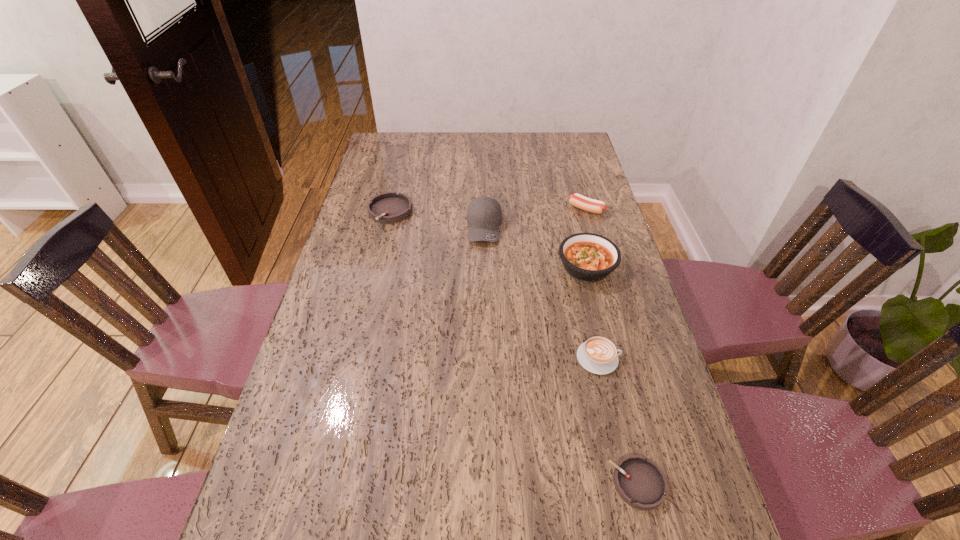
What are the coordinates of `the farther ashtray` in the screenshot? It's located at (389, 207).

You are a GUI agent. You are given a task and a screenshot of the screen. Output one action in this format:
    pyautogui.click(x=<x>, y=<y>)
    Task: Click on the leftmost object
    
    Given the screenshot: What is the action you would take?
    pyautogui.click(x=389, y=207)

At what (x,y) coordinates should I click in order to perform the action: click on the right ashtray. Please return your answer as a coordinate pair (x, y). Looking at the image, I should click on (640, 482).

Locate an element on the screen. This screenshot has width=960, height=540. the shorter ashtray is located at coordinates (640, 482).

Find the location of a particular element. The width and height of the screenshot is (960, 540). the fifth shortest object is located at coordinates 588,257.

Identify the location of the fourth farthest object. This screenshot has height=540, width=960. (588, 257).

Locate an element on the screen. This screenshot has width=960, height=540. the tallest object is located at coordinates (484, 215).

Identify the location of the second object from left to right. The height and width of the screenshot is (540, 960). (484, 215).

You are a GUI agent. You are given a task and a screenshot of the screen. Output one action in this format:
    pyautogui.click(x=<x>, y=<y>)
    Task: Click on the sausage
    This screenshot has height=540, width=960.
    Given the screenshot: What is the action you would take?
    pyautogui.click(x=591, y=205)

The image size is (960, 540). In order to click on the fifth farthest object in this screenshot , I will do `click(598, 355)`.